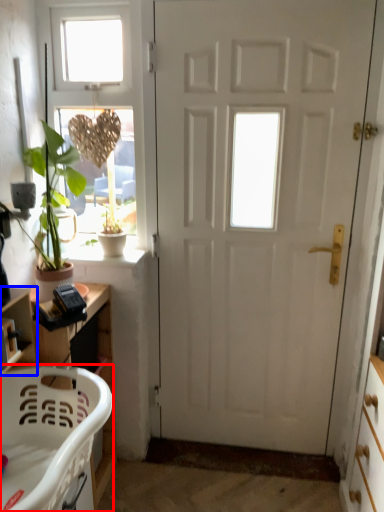
Question: Which object appears farthest to the camera in this image, chair (highlighted by a red box) or shelf (highlighted by a blue box)?

Choices:
 (A) chair
 (B) shelf

Answer: (B)